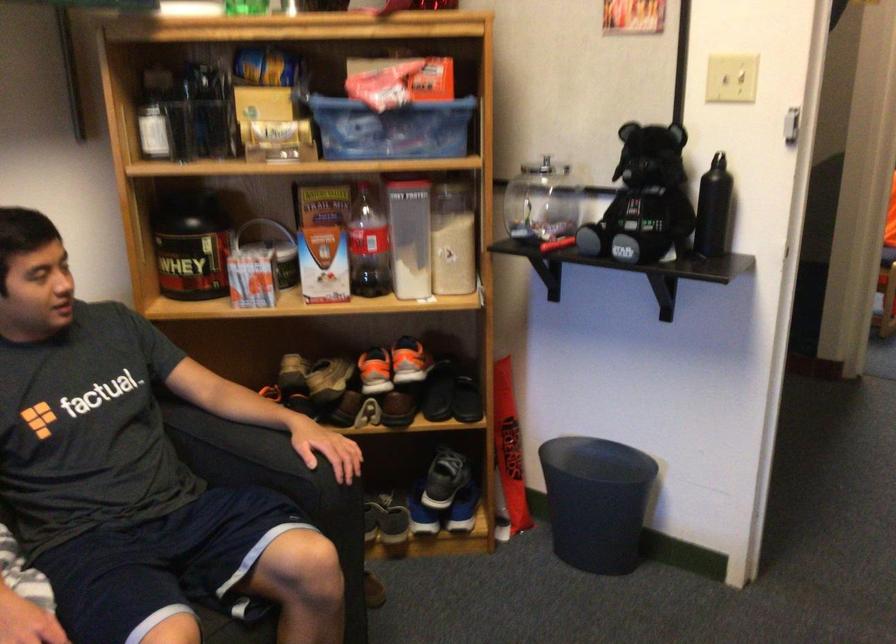
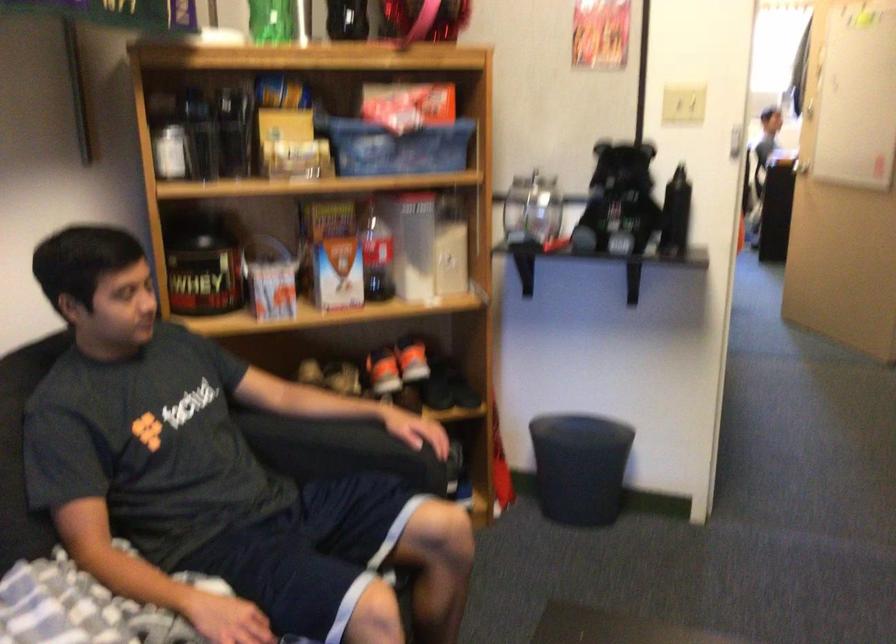
Find the pixel in the second image that matches the point at 239,448 in the first image.

(330, 444)